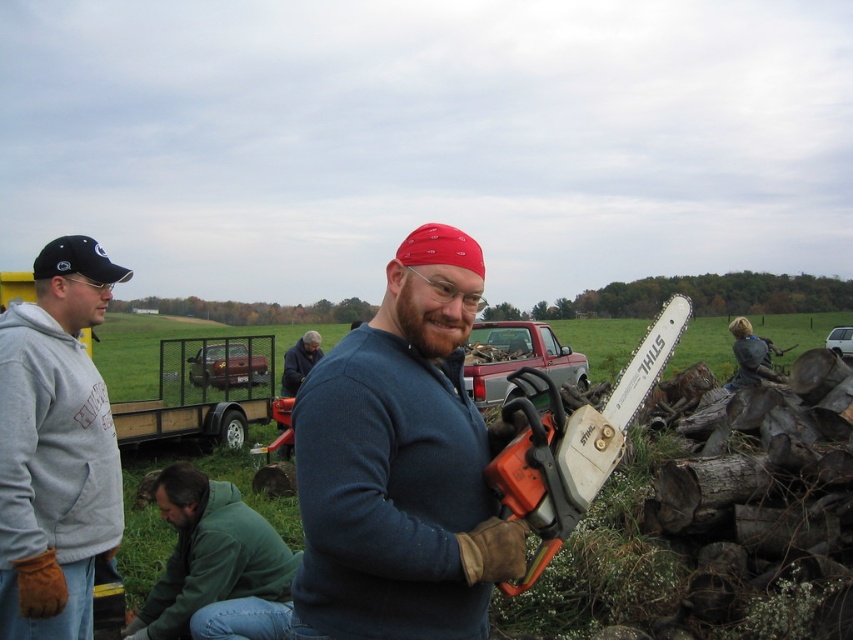
Question: Can you confirm if matte blue sweater at center is positioned to the left of green fuzzy jacket at lower left?

Choices:
 (A) yes
 (B) no

Answer: (B)

Question: Based on their relative distances, which object is nearer to the green fuzzy jacket at lower left?

Choices:
 (A) dark blue sweater at center
 (B) white plastic chainsaw at center-right

Answer: (B)

Question: Considering the real-world distances, which object is closest to the green fuzzy jacket at lower left?

Choices:
 (A) white plastic chainsaw at center-right
 (B) matte blue sweater at center
 (C) gray fleece sweatshirt at left
 (D) dark blue sweater at center

Answer: (C)

Question: Which point is farther from the camera taking this photo?

Choices:
 (A) coord(546,520)
 (B) coord(282,376)
 (C) coord(28,630)

Answer: (B)

Question: Does green fuzzy jacket at lower left have a smaller size compared to dark blue sweater at center?

Choices:
 (A) yes
 (B) no

Answer: (A)

Question: Does matte blue sweater at center appear on the left side of gray fleece sweatshirt at left?

Choices:
 (A) yes
 (B) no

Answer: (B)